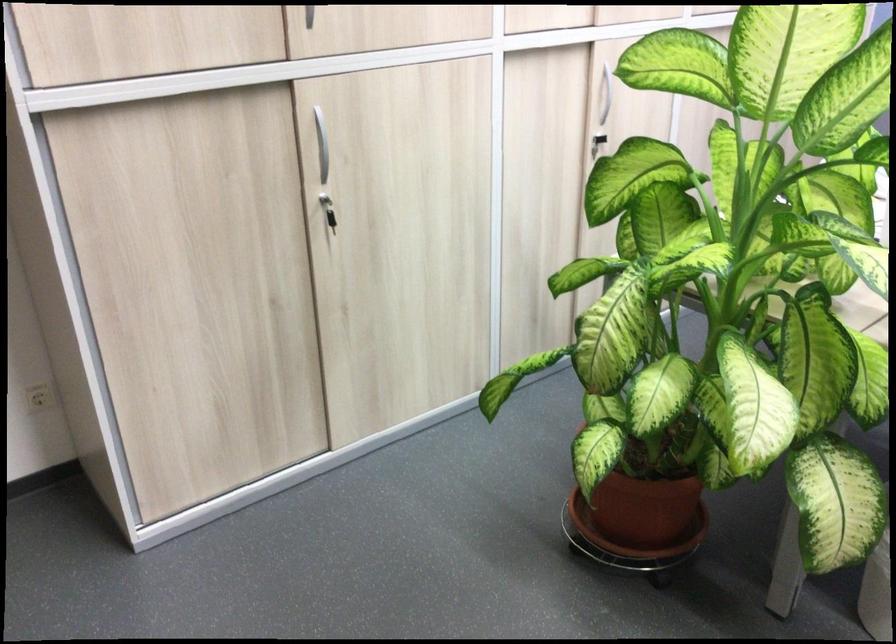
Where is `wheeled plant stand`? The width and height of the screenshot is (896, 644). wheeled plant stand is located at coordinates (636, 564).